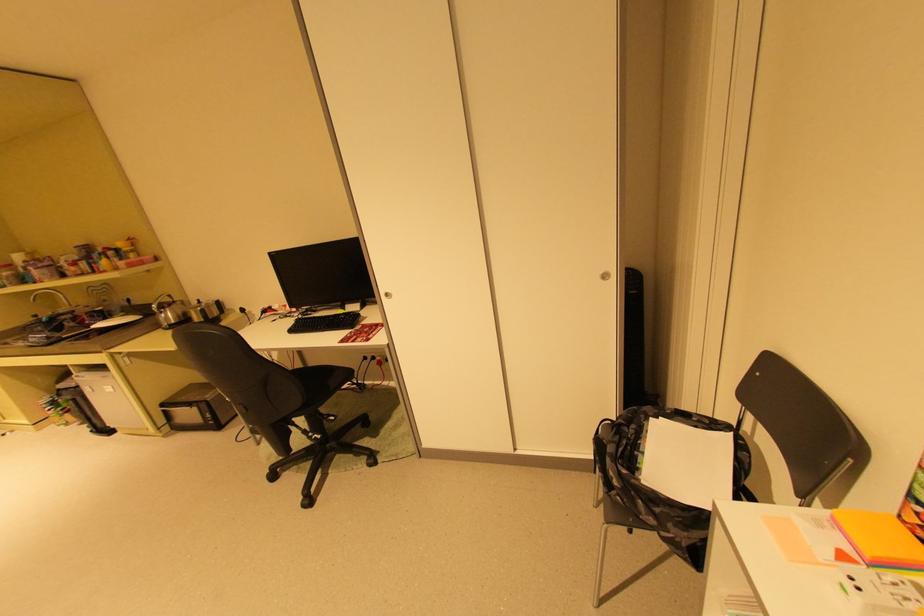
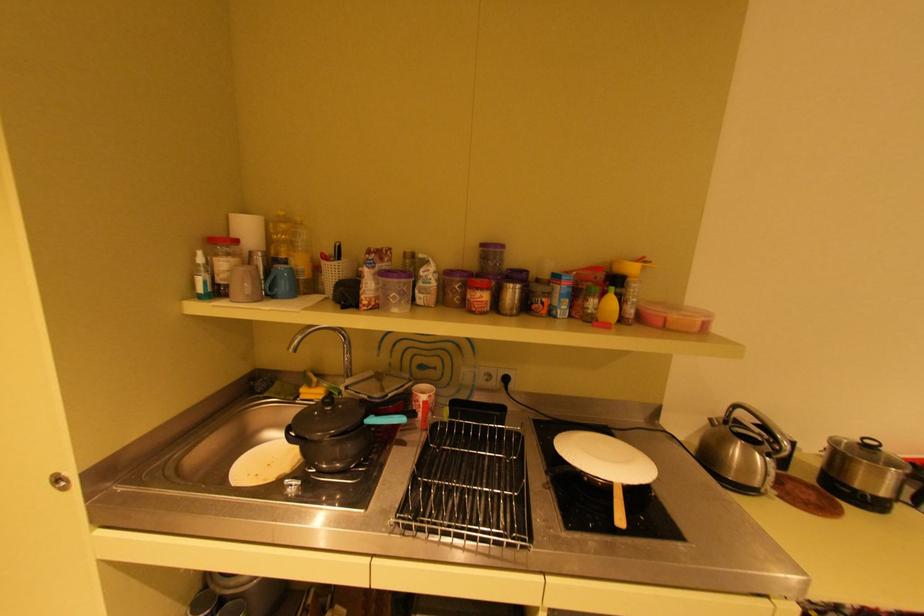
In a continuous first-person perspective shot, in which direction is the camera moving?

The movement direction of the cameraman is left, forward.